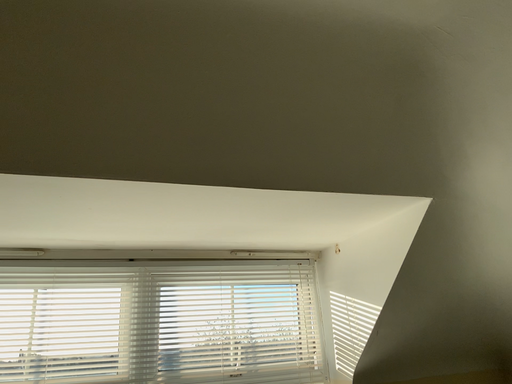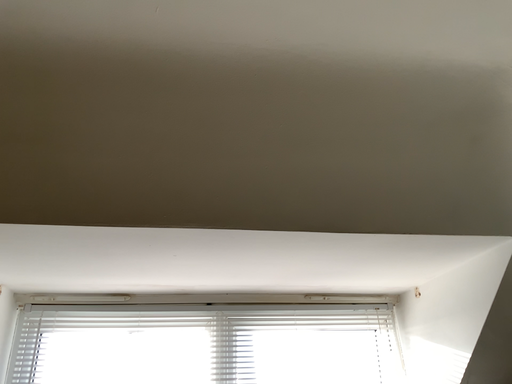
Question: Which way did the camera rotate in the video?

Choices:
 (A) rotated right
 (B) rotated left

Answer: (B)